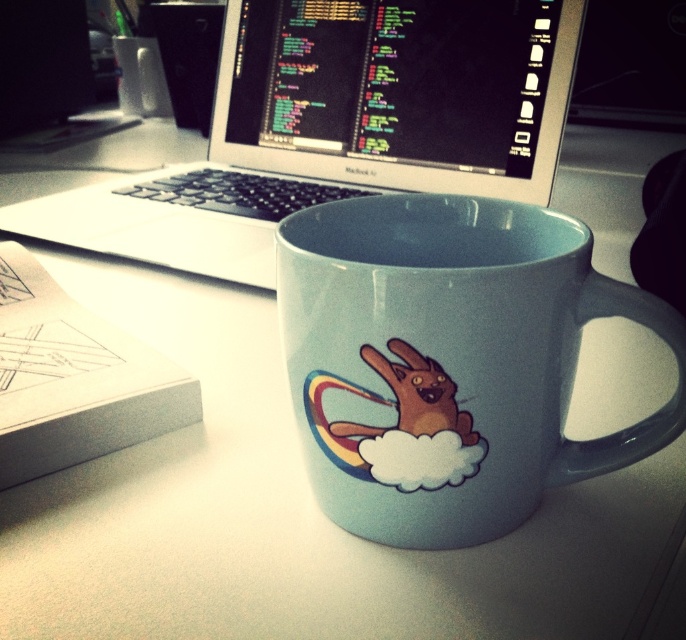
Question: Among these objects, which one is farthest from the camera?

Choices:
 (A) matte black monitor at upper left
 (B) sleek silver laptop at upper center
 (C) matte ceramic mug at center

Answer: (A)

Question: Is matte ceramic mug at center bigger than sleek silver laptop at upper center?

Choices:
 (A) yes
 (B) no

Answer: (B)

Question: Which point is farther from the camera taking this photo?

Choices:
 (A) (285, 90)
 (B) (8, 58)
 (C) (300, 282)

Answer: (B)

Question: Is sleek silver laptop at upper center wider than matte black monitor at upper left?

Choices:
 (A) yes
 (B) no

Answer: (A)

Question: Which of the following is the farthest from the observer?

Choices:
 (A) matte plastic laptop at upper center
 (B) matte ceramic mug at center
 (C) matte black monitor at upper left

Answer: (C)

Question: Can you confirm if sleek silver laptop at upper center is positioned to the right of matte black monitor at upper left?

Choices:
 (A) no
 (B) yes

Answer: (B)